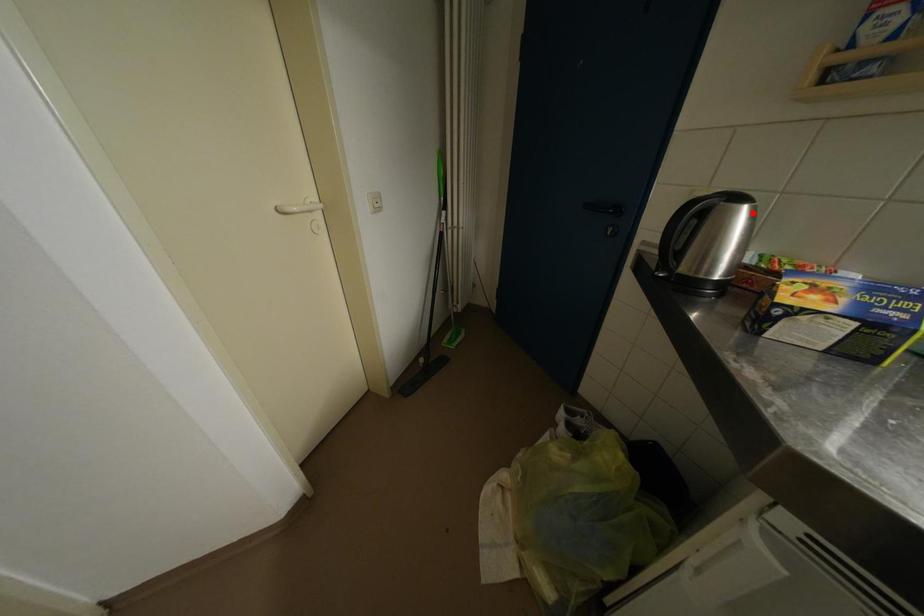
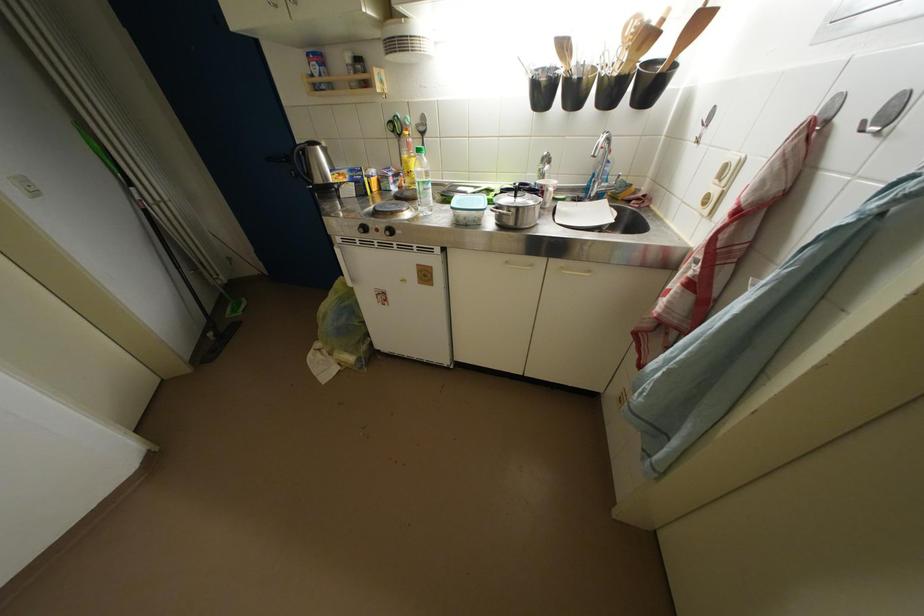
Find the pixel in the second image that matches the highlighted location in the first image.

(324, 152)